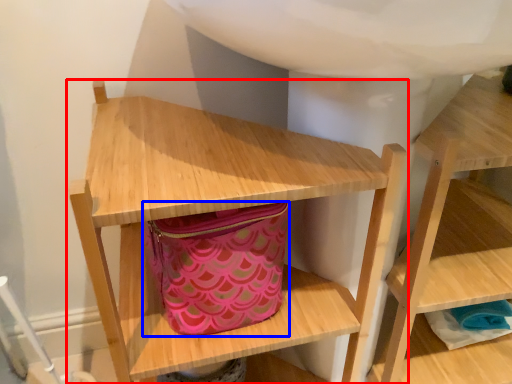
Question: Which object is closer to the camera taking this photo, shelf (highlighted by a red box) or bag (highlighted by a blue box)?

Choices:
 (A) shelf
 (B) bag

Answer: (A)